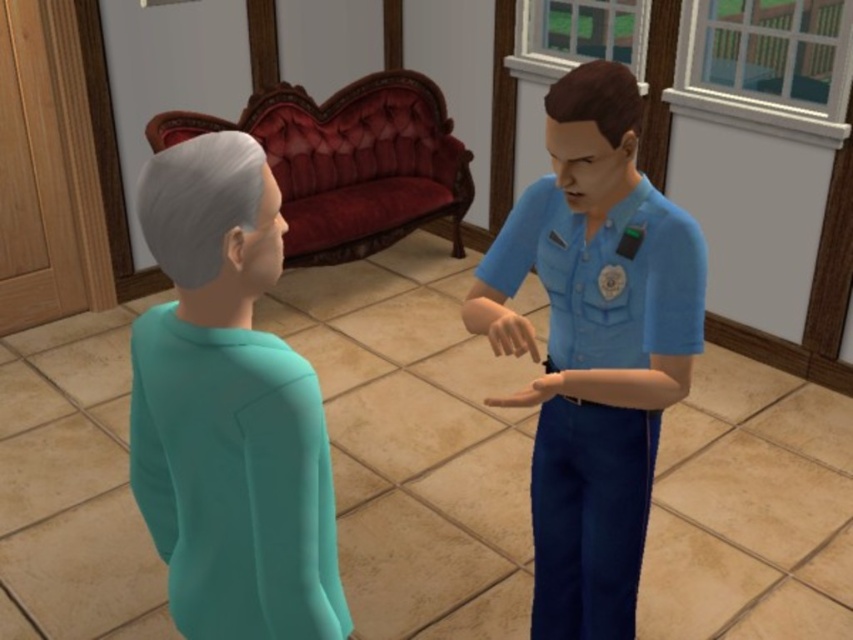
Does blue fabric uniform at right lie in front of teal matte sweater at lower left?

No.

Does blue fabric uniform at right have a lesser width compared to teal matte sweater at lower left?

Incorrect, blue fabric uniform at right's width is not less than teal matte sweater at lower left's.

I want to click on blue fabric uniform at right, so click(598, 388).

This screenshot has height=640, width=853. What are the coordinates of `blue fabric uniform at right` in the screenshot? It's located at (598, 388).